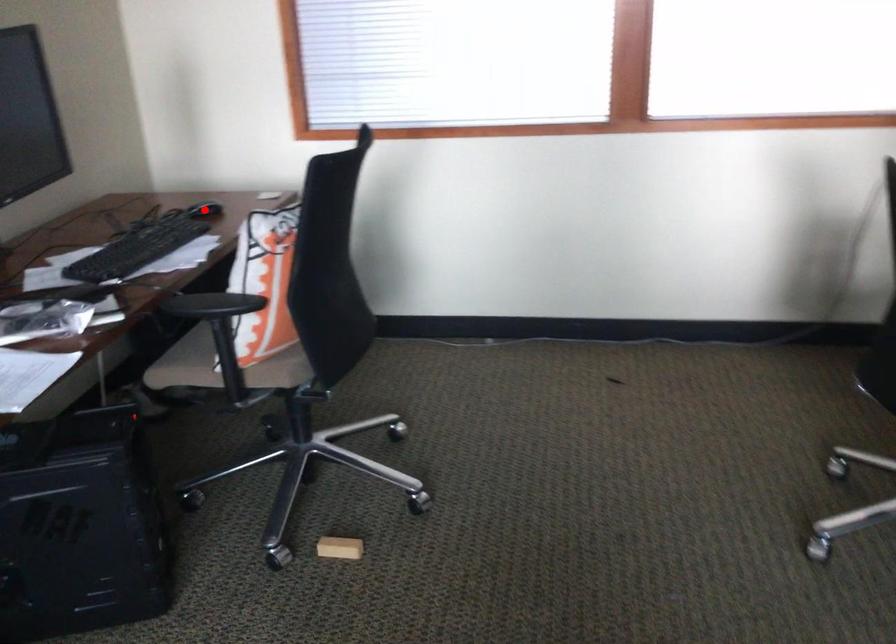
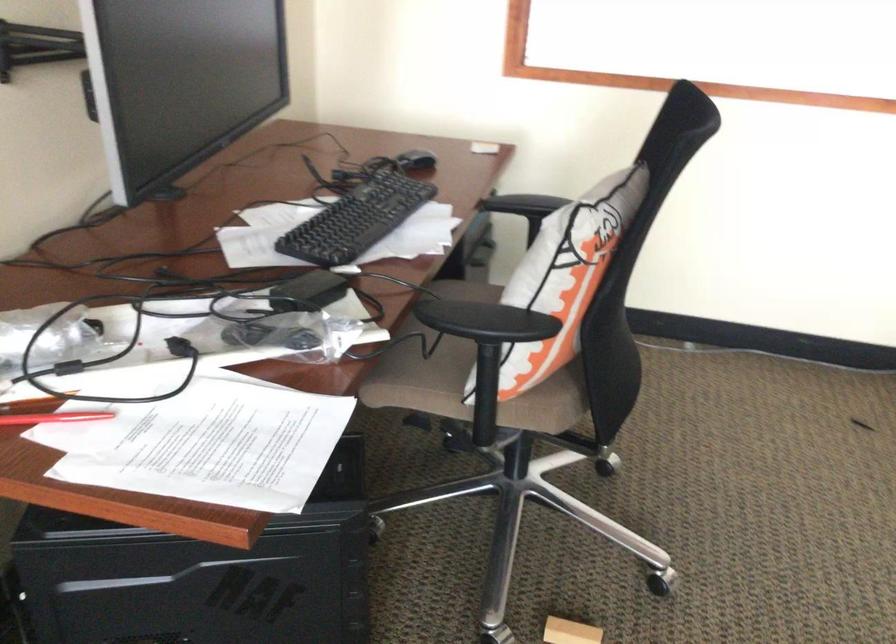
Locate, in the second image, the point that corresponds to the highlighted location in the first image.

(416, 162)